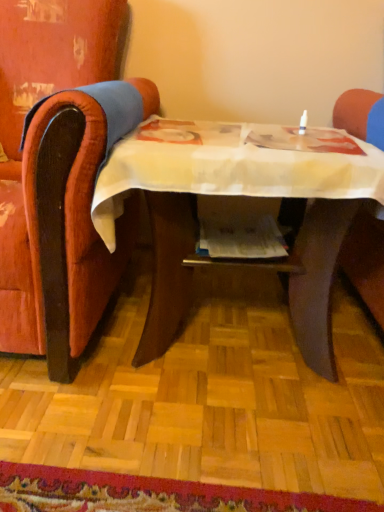
Question: Visually, is printed paper magazine at center positioned to the left or to the right of velvet-like red armchair at left?

Choices:
 (A) left
 (B) right

Answer: (B)

Question: Is printed paper magazine at center inside the boundaries of velvet-like red armchair at left, or outside?

Choices:
 (A) outside
 (B) inside

Answer: (A)

Question: Based on their relative distances, which object is nearer to the velvet-like red armchair at left?

Choices:
 (A) printed paper magazine at center
 (B) wooden table at center

Answer: (B)

Question: Which is farther from the velvet-like red armchair at left?

Choices:
 (A) printed paper magazine at center
 (B) wooden table at center

Answer: (A)